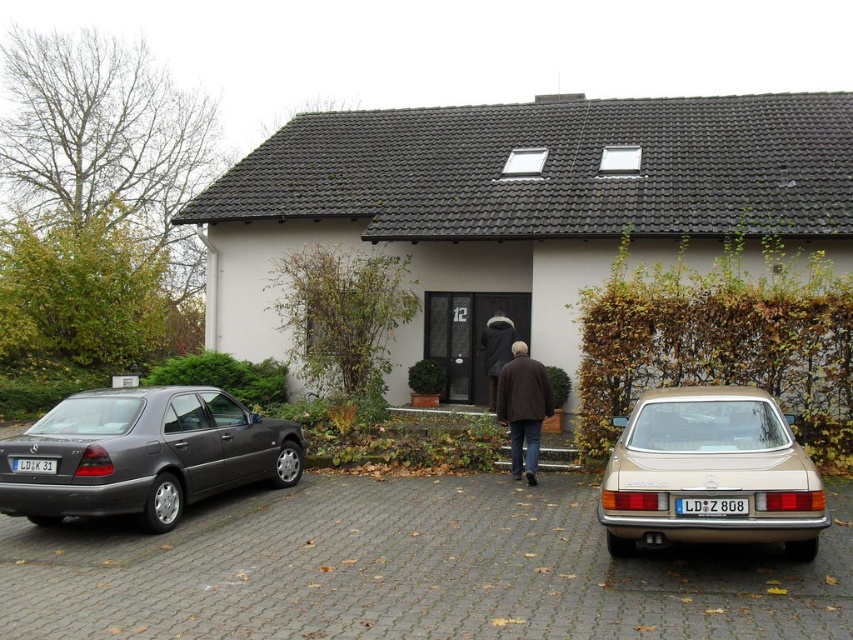
Who is more forward, [590,611] or [675,499]?

Point [590,611]

Can you confirm if gray cobblestone driveway at center is taller than blue plastic license plate at center?

Incorrect, gray cobblestone driveway at center's height is not larger of blue plastic license plate at center's.

What do you see at coordinates (410, 570) in the screenshot?
I see `gray cobblestone driveway at center` at bounding box center [410, 570].

Image resolution: width=853 pixels, height=640 pixels. I want to click on gray cobblestone driveway at center, so click(x=410, y=570).

Is brown wool coat at center above dark brown leather coat at center?

Incorrect, brown wool coat at center is not positioned above dark brown leather coat at center.

From the picture: Between brown wool coat at center and dark brown leather coat at center, which one is positioned higher?

dark brown leather coat at center is above.

Does point (521, 467) come closer to viewer compared to point (495, 362)?

Yes, it is.

Identify the location of brown wool coat at center. (523, 408).

Does point (712, 426) come in front of point (519, 374)?

Yes, point (712, 426) is closer to viewer.

Is point (701, 484) farther from camera compared to point (498, 412)?

No, it is not.

Locate an element on the screen. gold metallic car at lower right is located at coordinates (711, 472).